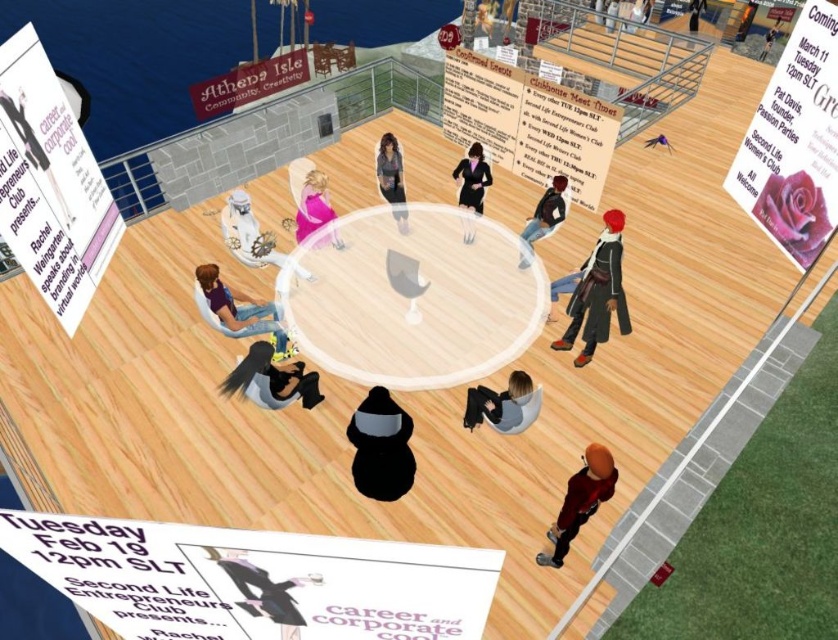
You are an avatar in the virtual event space and want to grab your shiny red jacket at lower right without moving from your current position at the matte gray chair at lower center. Can you reach it if your reach is 32 inches?

The shiny red jacket at lower right and matte gray chair at lower center are 33.13 inches apart from each other. Since your reach is 32 inches, you cannot reach the shiny red jacket at lower right from the matte gray chair at lower center.

You are a participant in the virtual event and need to locate the matte silver gear at center. Based on the coordinates provided, where should you look on your screen to find it?

The matte silver gear at center is located at the 2D coordinates point [247,234] on your screen.

You are organizing a virtual meeting and need to ensure that two avatars wearing the shiny red jacket at lower right and the matte black dress at center can sit comfortably next to each other. Given their clothing dimensions, which avatar requires more space between them and the adjacent seat?

The shiny red jacket at lower right requires more space because its width is larger than the matte black dress at center.